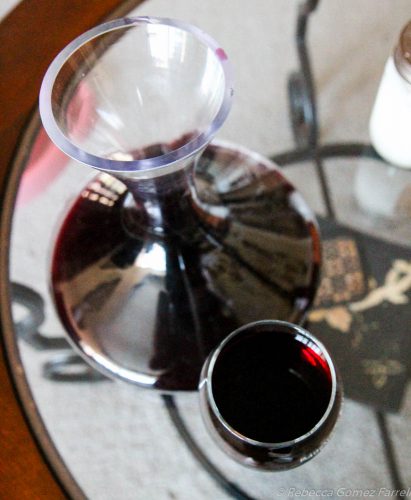
Where is `carafe`? The width and height of the screenshot is (411, 500). carafe is located at coordinates (225, 248).